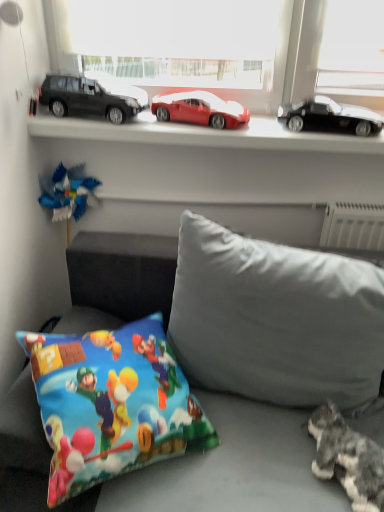
Question: Is printed fabric pillow at lower left, which appears as the 1th pillow when viewed from the left, taller than soft gray fabric couch at lower center?

Choices:
 (A) yes
 (B) no

Answer: (B)

Question: Are printed fabric pillow at lower left, which appears as the 1th pillow when viewed from the left, and soft gray fabric couch at lower center far apart?

Choices:
 (A) no
 (B) yes

Answer: (A)

Question: Is printed fabric pillow at lower left, which appears as the 1th pillow when viewed from the left, to the left of soft gray fabric couch at lower center from the viewer's perspective?

Choices:
 (A) no
 (B) yes

Answer: (B)

Question: From the image's perspective, is printed fabric pillow at lower left, which appears as the 1th pillow when viewed from the left, below soft gray fabric couch at lower center?

Choices:
 (A) no
 (B) yes

Answer: (A)

Question: Is soft gray fabric couch at lower center located within printed fabric pillow at lower left, which appears as the 1th pillow when viewed from the left?

Choices:
 (A) yes
 (B) no

Answer: (B)

Question: Can you confirm if printed fabric pillow at lower left, which appears as the 1th pillow when viewed from the left, is positioned to the right of soft gray fabric couch at lower center?

Choices:
 (A) no
 (B) yes

Answer: (A)

Question: Can you confirm if metallic cars at upper center is positioned to the left of soft gray fabric couch at lower center?

Choices:
 (A) yes
 (B) no

Answer: (A)

Question: Is the depth of metallic cars at upper center less than that of soft gray fabric couch at lower center?

Choices:
 (A) yes
 (B) no

Answer: (B)

Question: Considering the relative sizes of metallic cars at upper center and soft gray fabric couch at lower center in the image provided, is metallic cars at upper center shorter than soft gray fabric couch at lower center?

Choices:
 (A) no
 (B) yes

Answer: (B)

Question: Can you confirm if metallic cars at upper center is taller than soft gray fabric couch at lower center?

Choices:
 (A) yes
 (B) no

Answer: (B)

Question: From a real-world perspective, does metallic cars at upper center stand above soft gray fabric couch at lower center?

Choices:
 (A) yes
 (B) no

Answer: (A)

Question: From a real-world perspective, is metallic cars at upper center beneath soft gray fabric couch at lower center?

Choices:
 (A) yes
 (B) no

Answer: (B)

Question: Considering the relative positions of matte black car at left, which ranks as the first car in left-to-right order, and gray fabric pillow at center, arranged as the 1th pillow when viewed from the right, in the image provided, is matte black car at left, which ranks as the first car in left-to-right order, to the right of gray fabric pillow at center, arranged as the 1th pillow when viewed from the right, from the viewer's perspective?

Choices:
 (A) no
 (B) yes

Answer: (A)